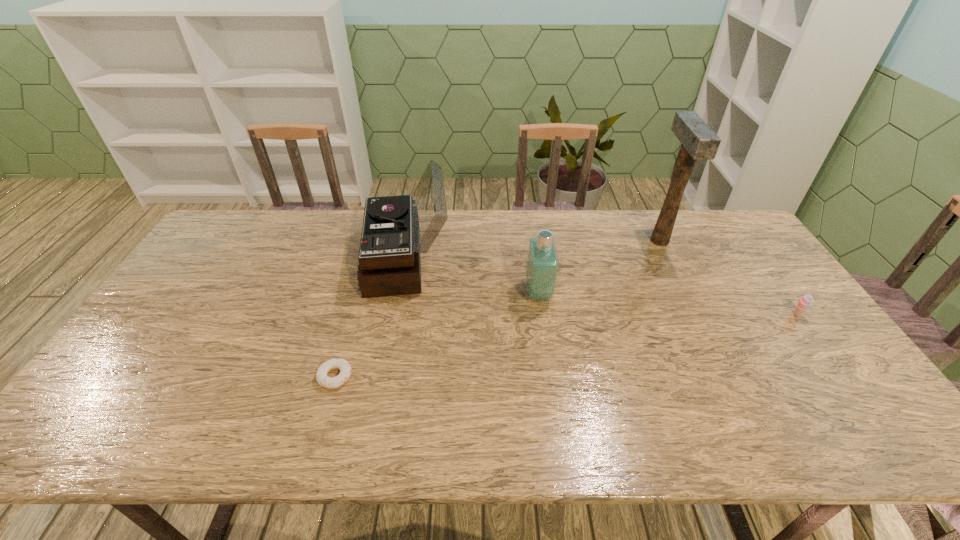
This screenshot has height=540, width=960. In the image, there is a desktop. Identify the location of vacant space at the near edge. (762, 416).

At what (x,y) coordinates should I click in order to perform the action: click on vacant space at the left edge of the desktop. Please return your answer as a coordinate pair (x, y). This screenshot has height=540, width=960. Looking at the image, I should click on (121, 390).

The height and width of the screenshot is (540, 960). In the image, there is a desktop. In order to click on vacant space at the right edge in this screenshot , I will do `click(838, 361)`.

The image size is (960, 540). I want to click on vacant space at the near left corner of the desktop, so click(141, 421).

This screenshot has width=960, height=540. I want to click on vacant space that's between the doughnut and the third tallest object, so point(437,335).

Locate an element on the screen. The image size is (960, 540). free space between the sherbert and the record player is located at coordinates (602, 288).

Locate an element on the screen. free space between the third tallest object and the tallest object is located at coordinates (599, 267).

Where is `free spot between the nearest object and the record player`? The image size is (960, 540). free spot between the nearest object and the record player is located at coordinates (371, 319).

Locate an element on the screen. The width and height of the screenshot is (960, 540). empty location between the rightmost object and the record player is located at coordinates (602, 288).

The height and width of the screenshot is (540, 960). In order to click on empty space that is in between the shortest object and the fourth shortest object in this screenshot , I will do click(x=371, y=319).